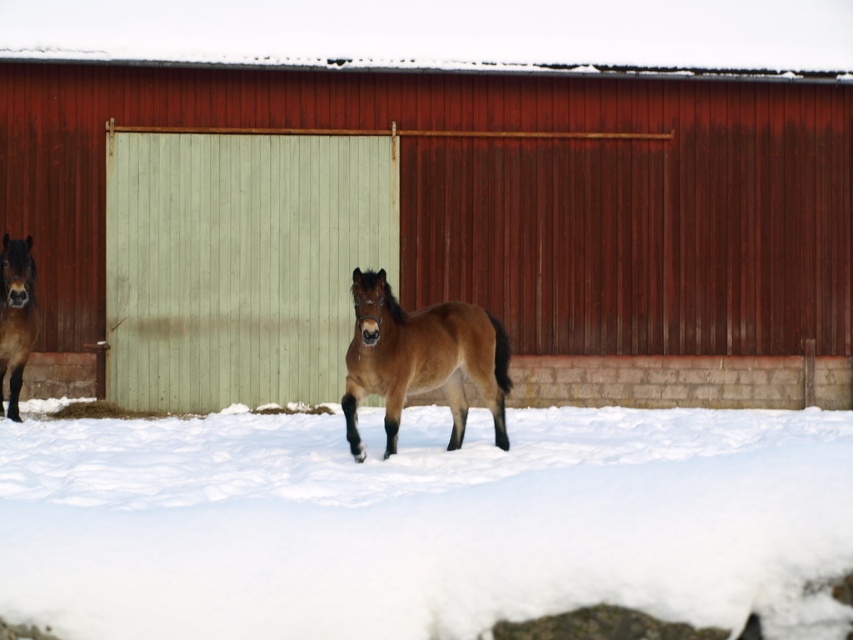
Is point (318, 260) in front of point (27, 348)?

That is False.

Does smooth wooden barn at center appear on the right side of brown glossy horse at left?

Indeed, smooth wooden barn at center is positioned on the right side of brown glossy horse at left.

Which is behind, point (74, 129) or point (9, 243)?

Positioned behind is point (74, 129).

Image resolution: width=853 pixels, height=640 pixels. Find the location of `smooth wooden barn at center`. smooth wooden barn at center is located at coordinates (433, 227).

Describe the element at coordinates (238, 262) in the screenshot. The image size is (853, 640). I see `green corrugated metal at center` at that location.

Which is more to the left, green corrugated metal at center or brown glossy horse at left?

From the viewer's perspective, brown glossy horse at left appears more on the left side.

This screenshot has height=640, width=853. Describe the element at coordinates (238, 262) in the screenshot. I see `green corrugated metal at center` at that location.

Image resolution: width=853 pixels, height=640 pixels. Identify the location of green corrugated metal at center. (238, 262).

Does smooth wooden barn at center have a greater width compared to brown glossy horse at center?

Correct, the width of smooth wooden barn at center exceeds that of brown glossy horse at center.

Is smooth wooden barn at center to the right of brown glossy horse at center from the viewer's perspective?

Correct, you'll find smooth wooden barn at center to the right of brown glossy horse at center.

Locate an element on the screen. This screenshot has height=640, width=853. smooth wooden barn at center is located at coordinates click(433, 227).